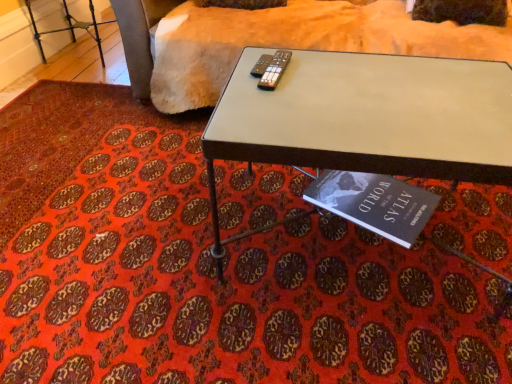
Question: From a real-world perspective, is soft beige fabric at upper center positioned over hardcover book at lower center based on gravity?

Choices:
 (A) yes
 (B) no

Answer: (A)

Question: From the image's perspective, is soft beige fabric at upper center above hardcover book at lower center?

Choices:
 (A) yes
 (B) no

Answer: (A)

Question: Is the surface of soft beige fabric at upper center in direct contact with hardcover book at lower center?

Choices:
 (A) yes
 (B) no

Answer: (B)

Question: Would you say soft beige fabric at upper center is outside hardcover book at lower center?

Choices:
 (A) yes
 (B) no

Answer: (A)

Question: Can you confirm if soft beige fabric at upper center is bigger than hardcover book at lower center?

Choices:
 (A) no
 (B) yes

Answer: (B)

Question: Is soft beige fabric at upper center at the left side of hardcover book at lower center?

Choices:
 (A) no
 (B) yes

Answer: (A)

Question: Is soft beige fabric at upper center positioned with its back to metallic gray table at center?

Choices:
 (A) yes
 (B) no

Answer: (B)

Question: Is metallic gray table at center inside soft beige fabric at upper center?

Choices:
 (A) no
 (B) yes

Answer: (A)

Question: From the image's perspective, is soft beige fabric at upper center over metallic gray table at center?

Choices:
 (A) yes
 (B) no

Answer: (A)

Question: Does soft beige fabric at upper center come behind metallic gray table at center?

Choices:
 (A) yes
 (B) no

Answer: (A)

Question: Can we say soft beige fabric at upper center lies outside metallic gray table at center?

Choices:
 (A) yes
 (B) no

Answer: (A)

Question: Does soft beige fabric at upper center turn towards metallic gray table at center?

Choices:
 (A) no
 (B) yes

Answer: (B)

Question: Is the position of hardcover book at lower center less distant than that of soft beige fabric at upper center?

Choices:
 (A) yes
 (B) no

Answer: (A)